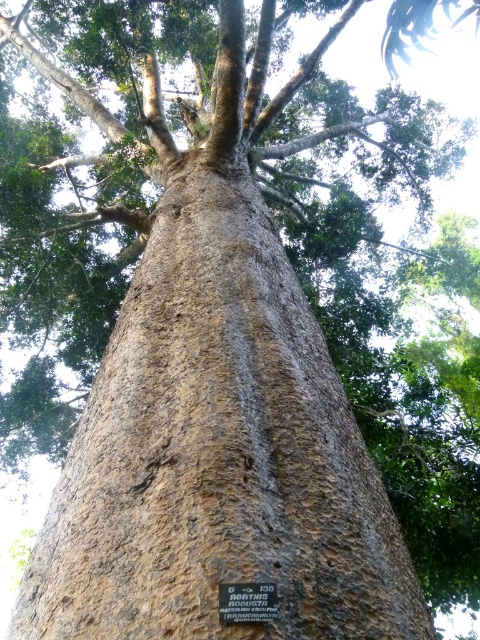
Based on the photo, is brown rough bark at center shorter than metallic plaque at center?

In fact, brown rough bark at center may be taller than metallic plaque at center.

Which is in front, point (372, 620) or point (220, 600)?

Point (220, 600)

Identify the location of brown rough bark at center. (216, 454).